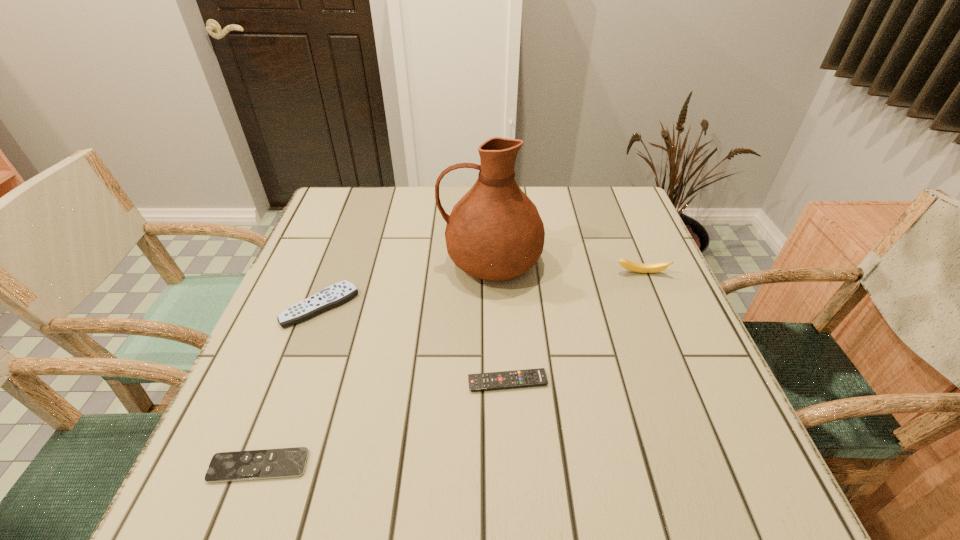
Image resolution: width=960 pixels, height=540 pixels. Find the location of `the tallest object`. the tallest object is located at coordinates (494, 232).

Where is `banana`? This screenshot has height=540, width=960. banana is located at coordinates (629, 265).

Identify the location of the rightmost object. This screenshot has height=540, width=960. (629, 265).

Find the location of a particular element. The image size is (960, 540). the tallest remote control is located at coordinates (338, 293).

I want to click on the third shortest object, so click(x=338, y=293).

This screenshot has height=540, width=960. Find the location of `the fourth tallest object`. the fourth tallest object is located at coordinates (530, 377).

Identify the location of the fourth farthest object. Image resolution: width=960 pixels, height=540 pixels. coord(530,377).

Identify the location of the nearest remote control. The image size is (960, 540). (285, 462).

The image size is (960, 540). I want to click on the shortest object, so click(285, 462).

The height and width of the screenshot is (540, 960). Find the location of `vacant space located 0.150m on the side of the tallest object with the handle`. vacant space located 0.150m on the side of the tallest object with the handle is located at coordinates (381, 261).